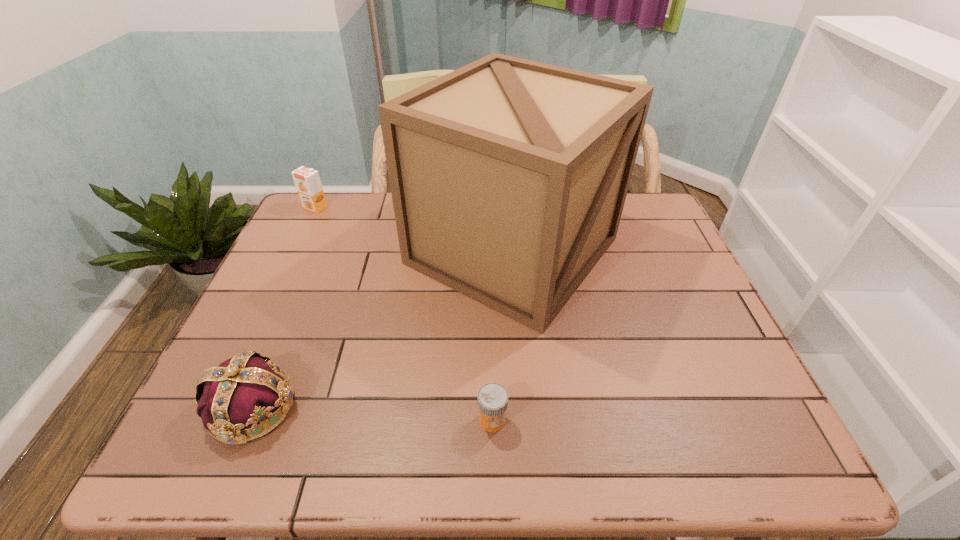
Identify the location of the tallest object. (508, 177).

Where is `orange juice`? This screenshot has height=540, width=960. orange juice is located at coordinates (307, 181).

The image size is (960, 540). Find the location of `crown`. crown is located at coordinates (246, 389).

You are a GUI agent. You are given a task and a screenshot of the screen. Output one action in this format:
    pyautogui.click(x=<x>, y=<y>)
    Task: Click on the medicine
    The width and height of the screenshot is (960, 540).
    Given the screenshot: What is the action you would take?
    (492, 399)

I want to click on vacant position located 0.320m on the left of the tallest object, so click(293, 251).

The image size is (960, 540). What are the coordinates of `free space located 0.240m on the front of the orange juice` in the screenshot? It's located at (288, 264).

Identify the location of vacant position located 0.340m on the right of the crown. (466, 408).

At what (x,y) coordinates should I click in order to perform the action: click on free space located 0.060m on the label side of the shortest object. Please return your answer as a coordinate pair (x, y). This screenshot has width=960, height=540. Looking at the image, I should click on (493, 464).

Image resolution: width=960 pixels, height=540 pixels. Identify the location of box that is at the far edge. (508, 177).

I want to click on orange juice present at the far edge, so click(307, 181).